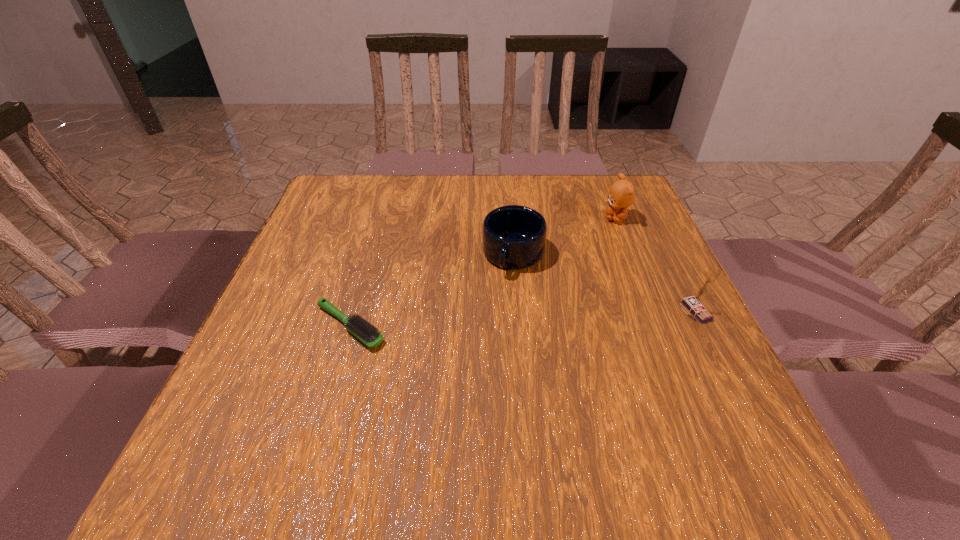
The height and width of the screenshot is (540, 960). I want to click on free space on the desktop that is between the leftmost object and the matchbox and is positioned with the handle on the side of the mug, so click(485, 320).

You are a GUI agent. You are given a task and a screenshot of the screen. Output one action in this format:
    pyautogui.click(x=<x>, y=<y>)
    Task: Click on the vacant space on the desktop that is between the hairbrush and the rightmost object and is positioned on the face of the teddy bear
    Image resolution: width=960 pixels, height=540 pixels.
    Given the screenshot: What is the action you would take?
    pyautogui.click(x=536, y=318)